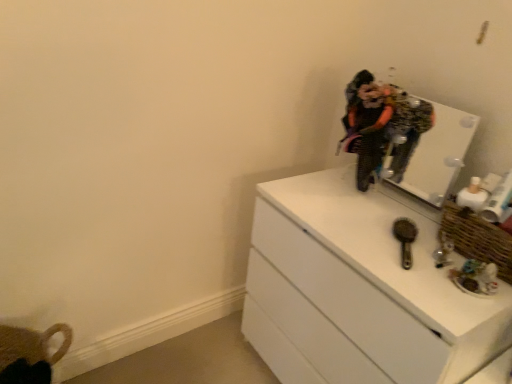
Question: From a real-world perspective, is white glossy mirror at upper right located higher than textured black dress at center?

Choices:
 (A) no
 (B) yes

Answer: (A)

Question: Considering the relative positions of white glossy mirror at upper right and textured black dress at center in the image provided, is white glossy mirror at upper right to the right of textured black dress at center from the viewer's perspective?

Choices:
 (A) no
 (B) yes

Answer: (B)

Question: Is white glossy mirror at upper right positioned behind textured black dress at center?

Choices:
 (A) yes
 (B) no

Answer: (B)

Question: Is white glossy mirror at upper right bigger than textured black dress at center?

Choices:
 (A) no
 (B) yes

Answer: (B)

Question: Is white glossy mirror at upper right to the left of textured black dress at center from the viewer's perspective?

Choices:
 (A) yes
 (B) no

Answer: (B)

Question: Does white glossy mirror at upper right have a greater height compared to textured black dress at center?

Choices:
 (A) no
 (B) yes

Answer: (A)

Question: Is white glossy chest of drawers at right far away from metallic brown brush at center-right?

Choices:
 (A) yes
 (B) no

Answer: (B)

Question: Can we say white glossy chest of drawers at right lies outside metallic brown brush at center-right?

Choices:
 (A) yes
 (B) no

Answer: (A)

Question: Is white glossy chest of drawers at right smaller than metallic brown brush at center-right?

Choices:
 (A) no
 (B) yes

Answer: (A)

Question: Does white glossy chest of drawers at right lie behind metallic brown brush at center-right?

Choices:
 (A) yes
 (B) no

Answer: (B)

Question: Is white glossy chest of drawers at right to the right of metallic brown brush at center-right from the viewer's perspective?

Choices:
 (A) yes
 (B) no

Answer: (B)

Question: Considering the relative sizes of white glossy chest of drawers at right and metallic brown brush at center-right in the image provided, is white glossy chest of drawers at right wider than metallic brown brush at center-right?

Choices:
 (A) no
 (B) yes

Answer: (B)

Question: Is metallic brown brush at center-right to the right of white glossy chest of drawers at right from the viewer's perspective?

Choices:
 (A) no
 (B) yes

Answer: (B)